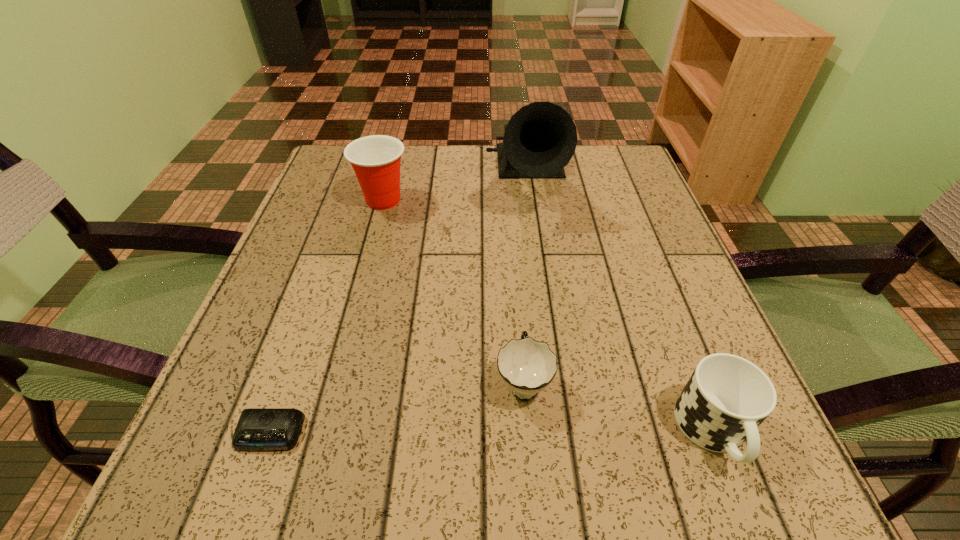
The height and width of the screenshot is (540, 960). I want to click on phonograph_record, so click(540, 139).

Identify the location of the leftmost cup. This screenshot has height=540, width=960. (376, 159).

Where is `the farthest cup`? This screenshot has width=960, height=540. the farthest cup is located at coordinates (376, 159).

I want to click on the rightmost cup, so click(x=727, y=397).

Where is `the second tallest cup`? The height and width of the screenshot is (540, 960). the second tallest cup is located at coordinates coord(727,397).

Identify the location of the shortest cup. This screenshot has width=960, height=540. (526, 366).

Image resolution: width=960 pixels, height=540 pixels. What are the coordinates of `the second cup from left to right` in the screenshot? It's located at (526, 366).

Locate an element on the screen. alarm clock is located at coordinates pos(258,429).

The width and height of the screenshot is (960, 540). Identify the location of blank area located from the horn of the tallest object. (537, 260).

Locate an element on the screen. This screenshot has width=960, height=540. vacant space located on the front of the farthest cup is located at coordinates (338, 372).